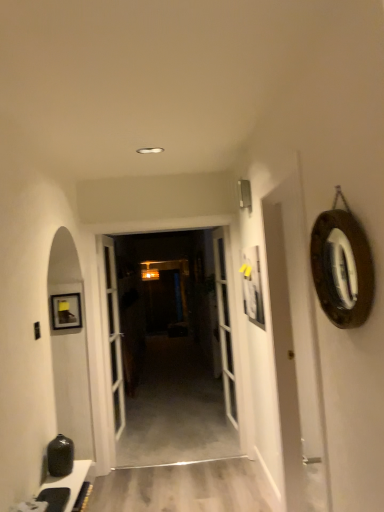
Question: Is wooden at center closer to the viewer compared to white glossy door at center, arranged as the first door when viewed from the left?

Choices:
 (A) yes
 (B) no

Answer: (B)

Question: Can you confirm if wooden at center is wider than white glossy door at center, arranged as the first door when viewed from the left?

Choices:
 (A) yes
 (B) no

Answer: (B)

Question: Can you confirm if wooden at center is shorter than white glossy door at center, arranged as the first door when viewed from the left?

Choices:
 (A) no
 (B) yes

Answer: (B)

Question: From a real-world perspective, is wooden at center physically below white glossy door at center, arranged as the first door when viewed from the left?

Choices:
 (A) no
 (B) yes

Answer: (A)

Question: From a real-world perspective, is wooden at center physically above white glossy door at center, positioned as the 2th door in right-to-left order?

Choices:
 (A) yes
 (B) no

Answer: (A)

Question: From the image's perspective, is white glass door at center, acting as the second door starting from the left, located above or below matte black cabinet at lower left?

Choices:
 (A) above
 (B) below

Answer: (A)

Question: Is point (235, 375) positioned closer to the camera than point (39, 489)?

Choices:
 (A) closer
 (B) farther

Answer: (B)

Question: In terms of width, does white glass door at center, the first door viewed from the right, look wider or thinner when compared to matte black cabinet at lower left?

Choices:
 (A) wide
 (B) thin

Answer: (A)

Question: Considering the relative positions of white glass door at center, the first door viewed from the right, and matte black cabinet at lower left in the image provided, is white glass door at center, the first door viewed from the right, to the left or to the right of matte black cabinet at lower left?

Choices:
 (A) right
 (B) left

Answer: (A)

Question: Looking at the image, does white glossy door at center, positioned as the 2th door in right-to-left order, seem bigger or smaller compared to wooden at center?

Choices:
 (A) big
 (B) small

Answer: (B)

Question: Considering their positions, is white glossy door at center, positioned as the 2th door in right-to-left order, located in front of or behind wooden at center?

Choices:
 (A) front
 (B) behind

Answer: (A)

Question: Based on their positions, is white glossy door at center, positioned as the 2th door in right-to-left order, located to the left or right of wooden at center?

Choices:
 (A) right
 (B) left

Answer: (B)

Question: In terms of width, does white glossy door at center, positioned as the 2th door in right-to-left order, look wider or thinner when compared to wooden at center?

Choices:
 (A) wide
 (B) thin

Answer: (A)

Question: From a real-world perspective, is wooden at center positioned above or below matte black cabinet at lower left?

Choices:
 (A) above
 (B) below

Answer: (A)

Question: Considering the relative positions of wooden at center and matte black cabinet at lower left in the image provided, is wooden at center to the left or to the right of matte black cabinet at lower left?

Choices:
 (A) right
 (B) left

Answer: (A)